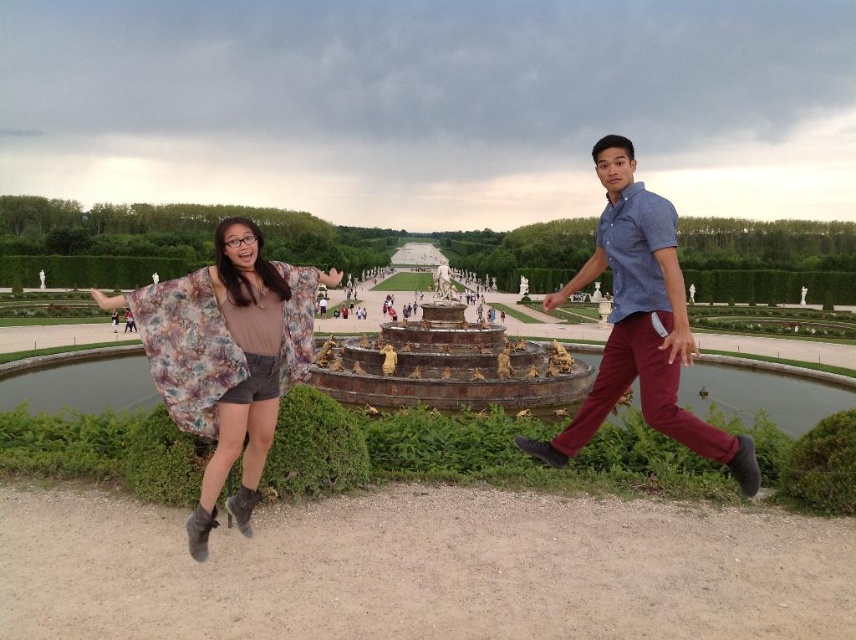
From the picture: Is floral fabric kimono at left smaller than bronze statue fountain at center?

Indeed, floral fabric kimono at left has a smaller size compared to bronze statue fountain at center.

Between floral fabric kimono at left and bronze statue fountain at center, which one appears on the left side from the viewer's perspective?

From the viewer's perspective, floral fabric kimono at left appears more on the left side.

This screenshot has height=640, width=856. Identify the location of floral fabric kimono at left. (227, 356).

Identify the location of floral fabric kimono at left. Image resolution: width=856 pixels, height=640 pixels. click(227, 356).

Between point (241, 493) and point (449, 292), which one is positioned behind?

The point (449, 292) is more distant.

Can you confirm if floral fabric kimono at left is taller than smooth bronze statue at center?

In fact, floral fabric kimono at left may be shorter than smooth bronze statue at center.

At what (x,y) coordinates should I click in order to perform the action: click on floral fabric kimono at left. Please return your answer as a coordinate pair (x, y). The height and width of the screenshot is (640, 856). Looking at the image, I should click on (227, 356).

Which of these two, blue cotton shirt at center or smooth bronze statue at center, stands taller?

smooth bronze statue at center is taller.

Who is more forward, [688,433] or [447,292]?

Point [688,433]

What do you see at coordinates (640, 324) in the screenshot?
I see `blue cotton shirt at center` at bounding box center [640, 324].

Locate an element on the screen. blue cotton shirt at center is located at coordinates [x=640, y=324].